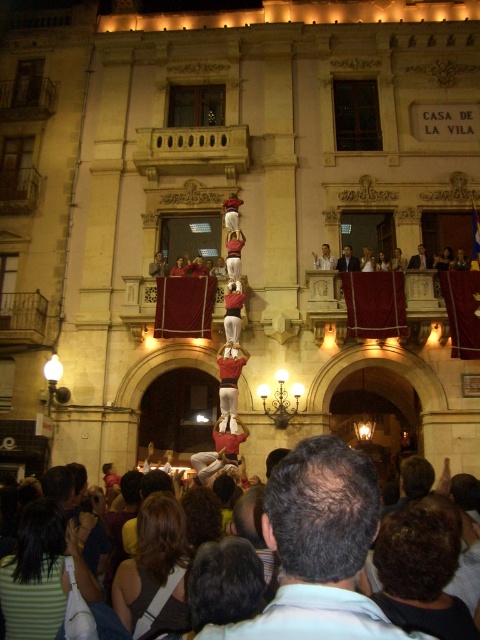
You are standing at the camera position and want to reach the point at coordinates [239,372]. The path is clear, but you have a 1.5 meter long ladder that you need to carry. Can you walk straight to the point without needing to adjust the ladder?

The point at coordinates [239,372] is 47.08 meters away from the camera. Since the path is clear and the ladder is only 1.5 meters long, you can easily walk straight to the point without needing to adjust the ladder as the distance is sufficient.

You are a photographer at the event and want to capture both the red fabric human at center and the smooth white shirt at upper center in a single photo. Since you can only focus on one subject at a time, which one should you choose to ensure the other remains in the background?

You should focus on the red fabric human at center because it is in front of the smooth white shirt at upper center. This way, the smooth white shirt at upper center will naturally appear in the background of the photo.

You are a photographer standing 10 meters away from the gray hair at center and smooth skin man at center. Can you fit both subjects into a single photo with your camera that has a 50mm lens? Explain why.

The gray hair at center and smooth skin man at center are 38.63 meters apart. With a 50mm lens, which has a moderate field of view, capturing both subjects in one frame would depend on your distance from them. Since you are 10 meters away, the subjects are far apart relative to your position, making it difficult to include both in the frame. A wider lens or moving closer would be necessary.